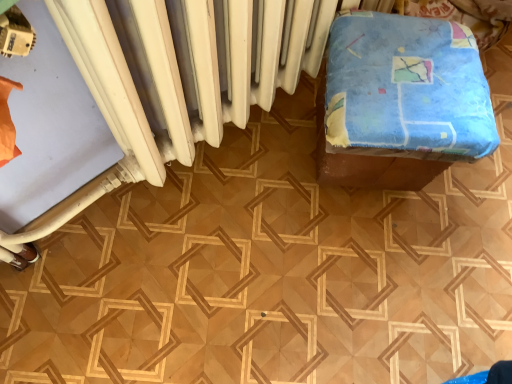
This screenshot has height=384, width=512. I want to click on vacant area that lies in front of white matte radiator at upper center, so click(x=296, y=247).